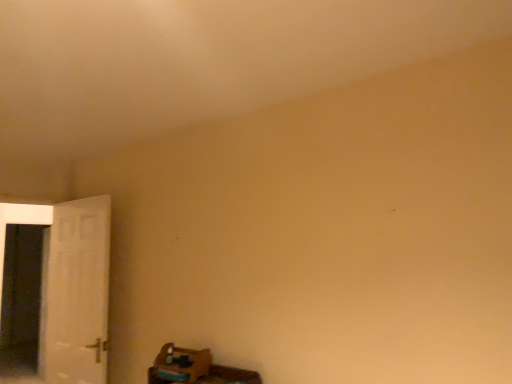
Question: Is white glossy screen door at left to the left or to the right of white matte door at left in the image?

Choices:
 (A) right
 (B) left

Answer: (B)

Question: In the image, is white glossy screen door at left positioned in front of or behind white matte door at left?

Choices:
 (A) behind
 (B) front

Answer: (A)

Question: Considering the positions of point tap(28, 344) and point tap(44, 319), is point tap(28, 344) closer or farther from the camera than point tap(44, 319)?

Choices:
 (A) farther
 (B) closer

Answer: (A)

Question: Is point (58, 292) positioned closer to the camera than point (23, 289)?

Choices:
 (A) farther
 (B) closer

Answer: (B)

Question: In the image, is white matte door at left on the left side or the right side of white glossy screen door at left?

Choices:
 (A) right
 (B) left

Answer: (A)

Question: Is white matte door at left situated inside white glossy screen door at left or outside?

Choices:
 (A) outside
 (B) inside

Answer: (A)

Question: From a real-world perspective, relative to white glossy screen door at left, is white matte door at left vertically above or below?

Choices:
 (A) above
 (B) below

Answer: (A)